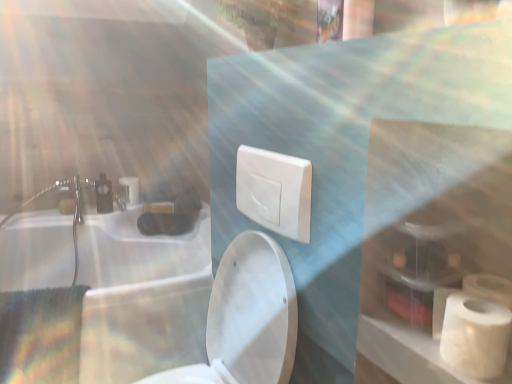
Describe the element at coordinates (128, 192) in the screenshot. I see `matte white faucet at upper left` at that location.

From the picture: In order to face white matte toilet paper at lower right, arranged as the 1th toilet paper when viewed from the top, should I rotate leftwards or rightwards?

You should rotate left by 23.998 degrees.

Identify the location of white matte toilet paper at right, the second toilet paper viewed from the left. (473, 295).

Identify the location of white glossy sink at upper left. The width and height of the screenshot is (512, 384). (141, 297).

In order to click on matte white faucet at upper left in this screenshot , I will do `click(128, 192)`.

Does white plastic switch at center have a larger size compared to white glossy sink at upper left?

Incorrect, white plastic switch at center is not larger than white glossy sink at upper left.

Considering the relative positions of white plastic switch at center and white glossy sink at upper left in the image provided, is white plastic switch at center in front of white glossy sink at upper left?

Yes, it is in front of white glossy sink at upper left.

Is white plastic switch at center oriented away from white glossy sink at upper left?

No, white plastic switch at center is not facing away from white glossy sink at upper left.

Can you confirm if white plastic switch at center is shorter than white glossy sink at upper left?

Indeed, white plastic switch at center has a lesser height compared to white glossy sink at upper left.

From the picture: Would you say white matte toilet paper at right, the second toilet paper viewed from the left, is inside or outside white matte toiletry bag at lower right?

white matte toilet paper at right, the second toilet paper viewed from the left, lies outside white matte toiletry bag at lower right.

Does point (440, 295) lie behind point (447, 356)?

Yes.

Which of these two, white matte toilet paper at right, positioned as the first toilet paper in front-to-back order, or white matte toiletry bag at lower right, is bigger?

white matte toiletry bag at lower right is bigger.

From a real-world perspective, is white matte toilet paper at right, the second toilet paper viewed from the left, under white matte toiletry bag at lower right?

Yes, from a real-world perspective, white matte toilet paper at right, the second toilet paper viewed from the left, is under white matte toiletry bag at lower right.

Can you tell me how much white matte toiletry bag at lower right and white plastic switch at center differ in facing direction?

The angular difference between white matte toiletry bag at lower right and white plastic switch at center is 1.42 degrees.

Is white matte toiletry bag at lower right to the right of white plastic switch at center from the viewer's perspective?

Indeed, white matte toiletry bag at lower right is positioned on the right side of white plastic switch at center.

Does white matte toiletry bag at lower right have a lesser height compared to white plastic switch at center?

Indeed, white matte toiletry bag at lower right has a lesser height compared to white plastic switch at center.

Consider the image. From the image's perspective, which one is positioned lower, white matte toiletry bag at lower right or white plastic switch at center?

white matte toiletry bag at lower right.

Considering the relative positions of white glossy sink at upper left and matte white faucet at upper left in the image provided, is white glossy sink at upper left to the right of matte white faucet at upper left from the viewer's perspective?

Correct, you'll find white glossy sink at upper left to the right of matte white faucet at upper left.

From the image's perspective, which is above, white glossy sink at upper left or matte white faucet at upper left?

matte white faucet at upper left, from the image's perspective.

How different are the orientations of white glossy sink at upper left and matte white faucet at upper left in degrees?

They differ by 0.000543 degrees in their facing directions.

In terms of width, does white glossy sink at upper left look wider or thinner when compared to matte white faucet at upper left?

white glossy sink at upper left is wider than matte white faucet at upper left.

From a real-world perspective, is white matte toiletry bag at lower right positioned over matte white faucet at upper left based on gravity?

Yes, from a real-world perspective, white matte toiletry bag at lower right is on top of matte white faucet at upper left.

Is white matte toiletry bag at lower right facing away from matte white faucet at upper left?

No, matte white faucet at upper left is not at the back of white matte toiletry bag at lower right.

How many degrees apart are the facing directions of white matte toiletry bag at lower right and matte white faucet at upper left?

The facing directions of white matte toiletry bag at lower right and matte white faucet at upper left are 90.6 degrees apart.

Is white matte toiletry bag at lower right further to camera compared to matte white faucet at upper left?

No, white matte toiletry bag at lower right is closer to the viewer.

Between white matte toilet paper at lower right, positioned as the second toilet paper in front-to-back order, and white matte toilet paper at right, the first toilet paper ordered from the bottom, which one appears on the left side from the viewer's perspective?

Positioned to the left is white matte toilet paper at lower right, positioned as the second toilet paper in front-to-back order.

Is point (73, 203) positioned behind point (494, 301)?

Yes, it is.

Does white matte toilet paper at lower right, arranged as the 1th toilet paper when viewed from the top, have a smaller size compared to white matte toilet paper at right, the first toilet paper when ordered from right to left?

Correct, white matte toilet paper at lower right, arranged as the 1th toilet paper when viewed from the top, occupies less space than white matte toilet paper at right, the first toilet paper when ordered from right to left.

From the image's perspective, is matte white faucet at upper left positioned above or below white glossy toilet at center?

matte white faucet at upper left is situated higher than white glossy toilet at center in the image.

Could you tell me if matte white faucet at upper left is facing white glossy toilet at center?

Yes, matte white faucet at upper left is oriented towards white glossy toilet at center.

Considering the positions of objects matte white faucet at upper left and white glossy toilet at center in the image provided, who is more to the left, matte white faucet at upper left or white glossy toilet at center?

matte white faucet at upper left is more to the left.

Find the location of a particular element. Image resolution: width=512 pixels, height=384 pixels. toilet on the right of matte white faucet at upper left is located at coordinates (247, 318).

At what (x,y) coordinates should I click in order to perform the action: click on bath lying behind the white plastic switch at center. Please return your answer as a coordinate pair (x, y). The width and height of the screenshot is (512, 384). Looking at the image, I should click on (141, 297).

Locate an element on the screen. This screenshot has width=512, height=384. toilet paper that is the 1st object located above the white matte toiletry bag at lower right (from the image's perspective) is located at coordinates (473, 295).

Estimate the real-world distances between objects in this image. Which object is further from white matte toilet paper at lower right, the first toilet paper viewed from the back, white glossy toilet at center or white matte toilet paper at right, positioned as the first toilet paper in front-to-back order?

Based on the image, white matte toilet paper at right, positioned as the first toilet paper in front-to-back order, appears to be further to white matte toilet paper at lower right, the first toilet paper viewed from the back.

Which object lies nearer to the anchor point white plastic switch at center, white matte toilet paper at right, the second toilet paper viewed from the left, or white matte toiletry bag at lower right?

Based on the image, white matte toilet paper at right, the second toilet paper viewed from the left, appears to be nearer to white plastic switch at center.

Considering their positions, is white glossy toilet at center positioned closer to white matte toilet paper at right, the first toilet paper ordered from the bottom, than white plastic switch at center?

white plastic switch at center lies closer to white matte toilet paper at right, the first toilet paper ordered from the bottom, than the other object.

When comparing their distances from matte white faucet at upper left, does white glossy toilet at center or white glossy sink at upper left seem closer?

white glossy sink at upper left.

When comparing their distances from white glossy toilet at center, does matte white faucet at upper left or white matte toilet paper at right, the first toilet paper ordered from the bottom, seem further?

matte white faucet at upper left is further to white glossy toilet at center.

From the image, which object appears to be nearer to white glossy sink at upper left, matte white faucet at upper left or white plastic switch at center?

matte white faucet at upper left.

Considering their positions, is white glossy toilet at center positioned closer to white matte toiletry bag at lower right than white matte toilet paper at lower right, the first toilet paper viewed from the back?

Based on the image, white glossy toilet at center appears to be nearer to white matte toiletry bag at lower right.

From the image, which object appears to be nearer to white matte toiletry bag at lower right, white glossy sink at upper left or matte white faucet at upper left?

Based on the image, white glossy sink at upper left appears to be nearer to white matte toiletry bag at lower right.

Locate an element on the screen. The image size is (512, 384). toilet between white matte toiletry bag at lower right and matte white faucet at upper left in the front-back direction is located at coordinates (247, 318).

The height and width of the screenshot is (384, 512). I want to click on toiletry bag located between white glossy sink at upper left and white matte toilet paper at right, arranged as the 2th toilet paper when viewed from the top, in the left-right direction, so [475, 335].

At what (x,y) coordinates should I click in order to perform the action: click on electric outlet between white glossy sink at upper left and white matte toiletry bag at lower right from left to right. Please return your answer as a coordinate pair (x, y). Looking at the image, I should click on (275, 191).

Locate an element on the screen. This screenshot has height=384, width=512. toilet paper located between white glossy toilet at center and white matte toilet paper at lower right, the first toilet paper viewed from the back, in the depth direction is located at coordinates (473, 295).